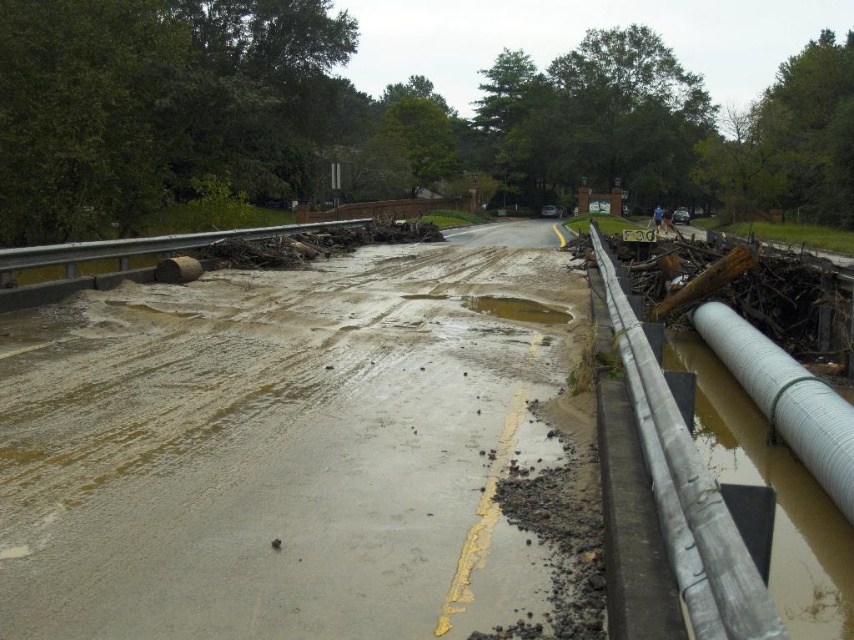
You are a surveyor assessing flood damage. You need to determine if the white corrugated pipe at right can be used to drain water from the muddy concrete road at center. Based on their heights, will the pipe be able to effectively drain the road?

The muddy concrete road at center is much taller than the white corrugated pipe at right. This means the road is higher, so water would naturally flow towards the lower elevation of the pipe, making it possible for the pipe to effectively drain the road.

You are standing at the edge of the flooded road and want to cross to the other side. There are two points marked on the road surface. Which point, point (480, 493) or point (525, 307), is closer to you and safer to step on first?

Point (480, 493) is closer to the viewer than point (525, 307), so it would be safer to step on point (480, 493) first since it is nearer to your current position.